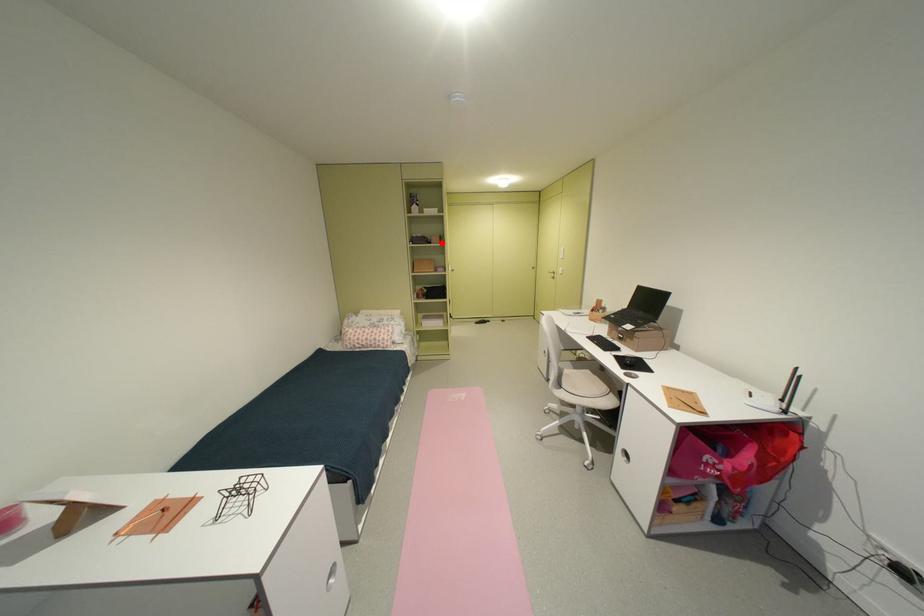
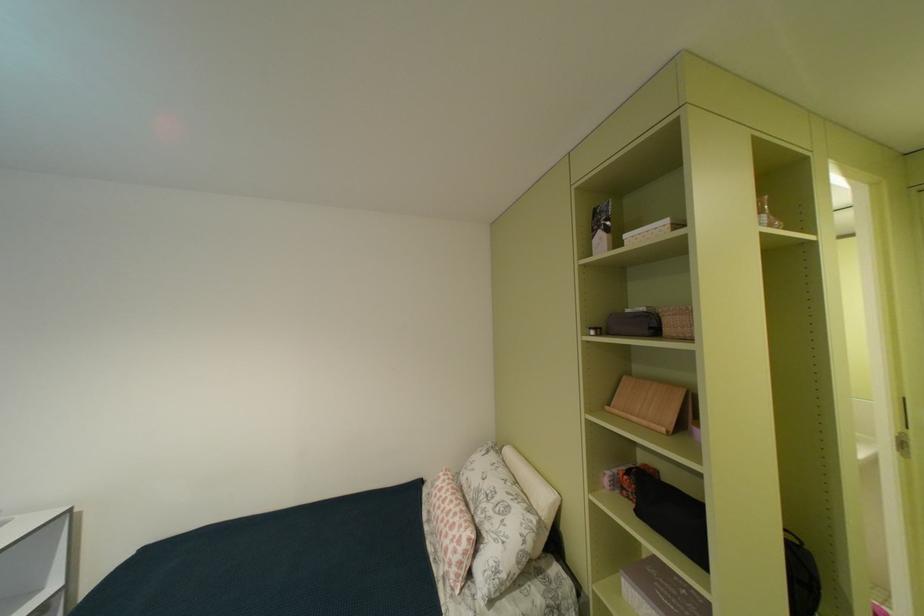
The point at the highlighted location is marked in the first image. Where is the corresponding point in the second image?

(675, 331)